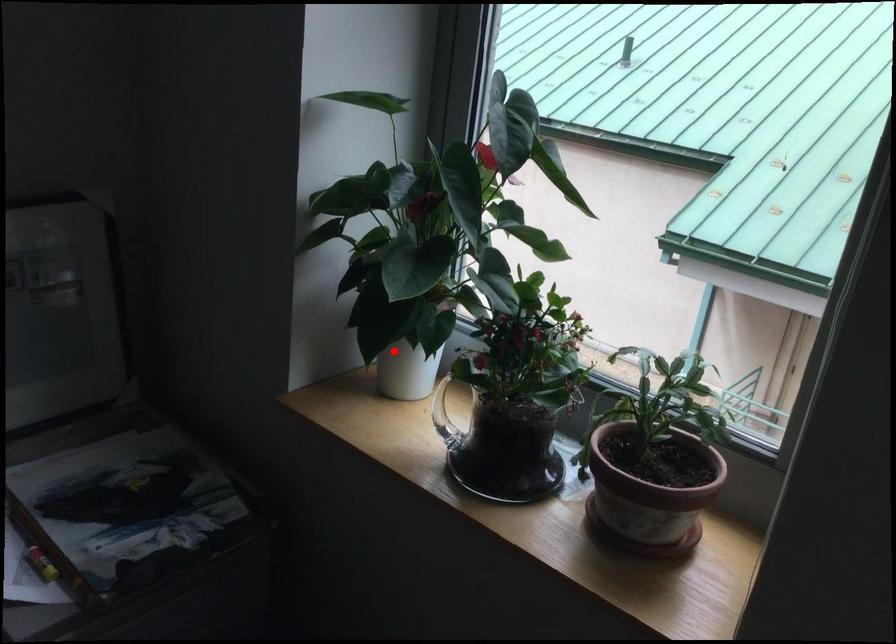
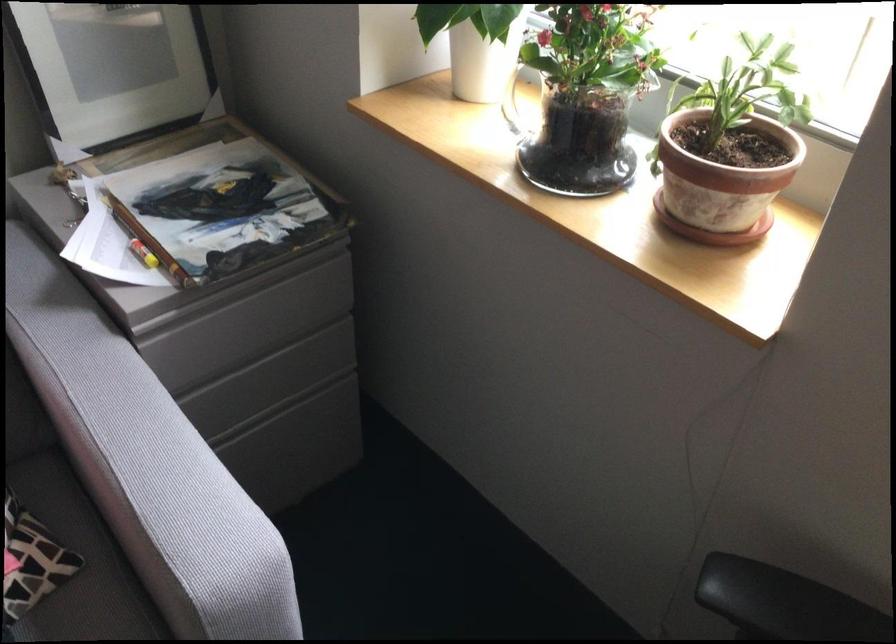
Locate, in the second image, the point that corresponds to the highlighted location in the first image.

(467, 44)